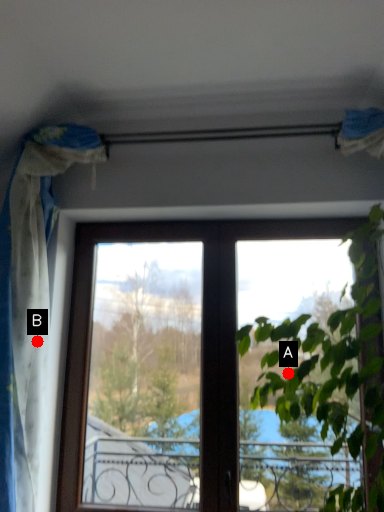
Question: Two points are circled on the image, labeled by A and B beside each circle. Which point is farther from the camera taking this photo?

Choices:
 (A) A is further
 (B) B is further

Answer: (A)